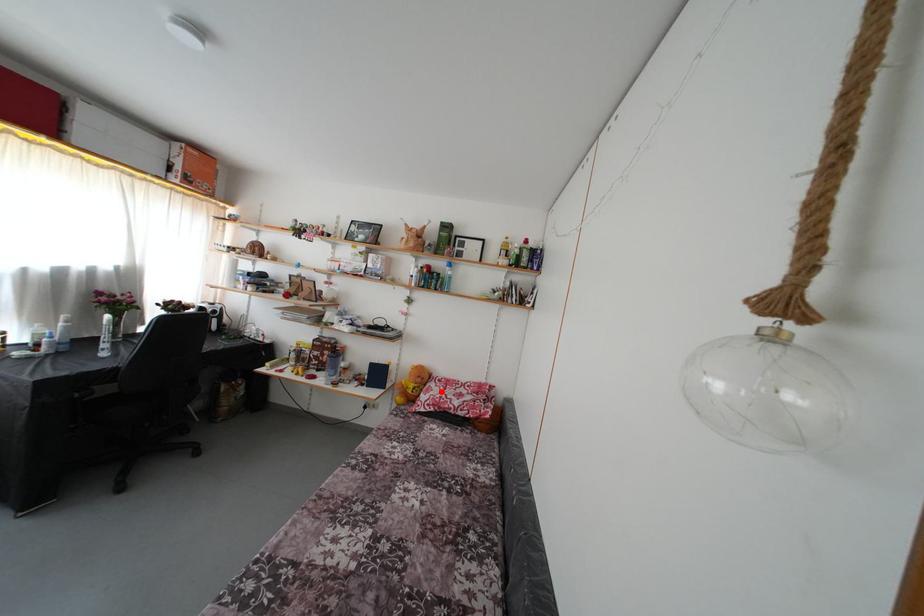
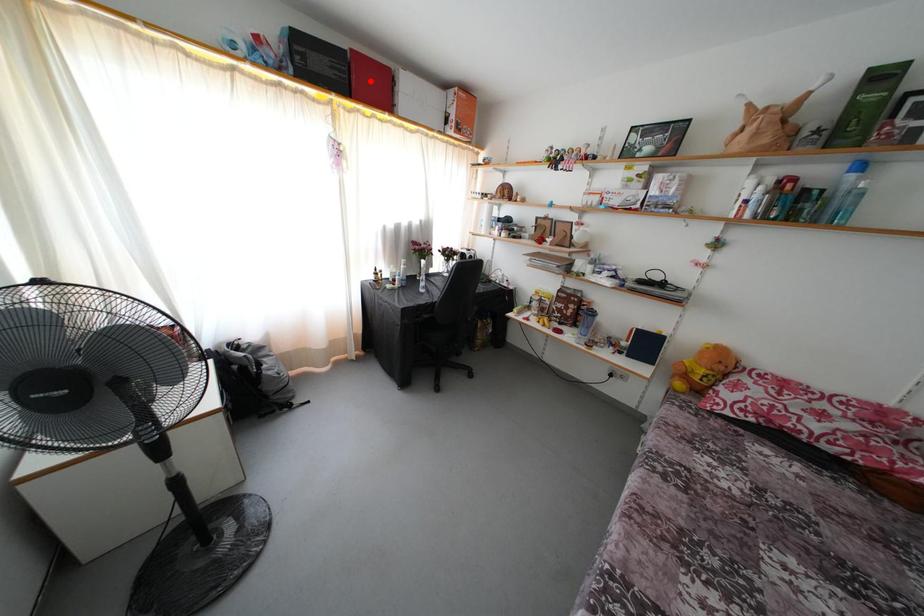
From the picture: I am providing you with two images of the same scene from different viewpoints. A red point is marked on the first image and another point is marked on the second image. Are the points marked in image1 and image2 representing the same 3D position?

No